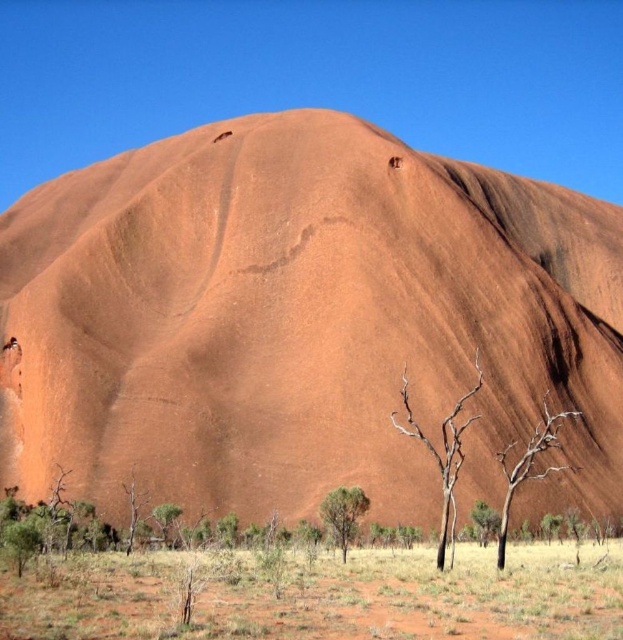
You are standing at the base of Uluru and notice a brown bark tree at lower right and a green leafy shrub at lower left. Which of these two plants is positioned higher up relative to the ground level?

The brown bark tree at lower right is located above the green leafy shrub at lower left, meaning it is positioned higher up relative to the ground level.

You are standing at the base of Uluru and want to take a photo of both point (307, 292) and point (497, 547). Which point will appear closer to the camera in your photo?

Point (307, 292) is further to the camera than point (497, 547), so the point (497, 547) will appear closer to the camera in the photo.

You are a hiker standing at the base of the matte sandstone hill at center and want to reach the brown bark tree at lower right. Which direction should you move to get there?

The matte sandstone hill at center is positioned over the brown bark tree at lower right, so to reach the brown bark tree at lower right, you should move downward from the matte sandstone hill at center.